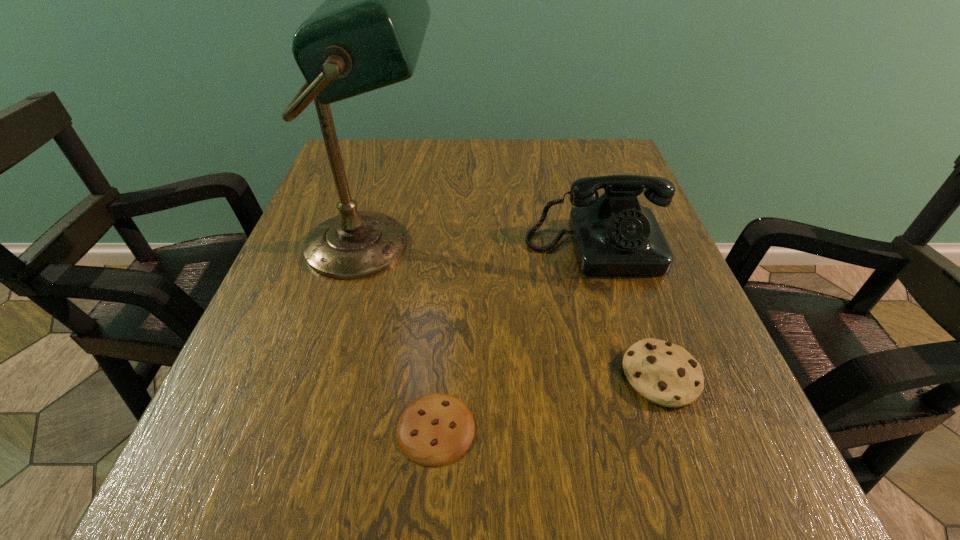
You are a GUI agent. You are given a task and a screenshot of the screen. Output one action in this format:
    pyautogui.click(x=<x>, y=<y>)
    Task: Click on the free space that is in between the shortest object and the tallest object
    
    Given the screenshot: What is the action you would take?
    pyautogui.click(x=404, y=336)

I want to click on object that is the third nearest to the table lamp, so click(664, 373).

Identify which object is the third closest to the shortest object. Please provide its 2D coordinates. Your answer should be formatted as a tuple, i.e. [(x, y)], where the tuple contains the x and y coordinates of a point satisfying the conditions above.

[(613, 234)]

This screenshot has height=540, width=960. Find the location of `vacant space that satisfies the following two spatial constraints: 1. above the green lampshade of the tallest object; 2. on the back side of the taller cookie`. vacant space that satisfies the following two spatial constraints: 1. above the green lampshade of the tallest object; 2. on the back side of the taller cookie is located at coordinates (337, 375).

Where is `vacant space that satisfies the following two spatial constraints: 1. above the green lampshade of the table lamp; 2. on the right side of the right cookie`? The height and width of the screenshot is (540, 960). vacant space that satisfies the following two spatial constraints: 1. above the green lampshade of the table lamp; 2. on the right side of the right cookie is located at coordinates (337, 375).

The image size is (960, 540). What are the coordinates of `vacant space that satisfies the following two spatial constraints: 1. above the green lampshade of the shortest object; 2. on the right side of the tallest object` in the screenshot? It's located at (323, 428).

This screenshot has height=540, width=960. I want to click on free space that satisfies the following two spatial constraints: 1. on the back side of the shortest object; 2. above the green lampshade of the table lamp, so click(x=450, y=245).

Locate an element on the screen. The height and width of the screenshot is (540, 960). vacant space that satisfies the following two spatial constraints: 1. on the back side of the right cookie; 2. above the green lampshade of the table lamp is located at coordinates (615, 245).

You are a GUI agent. You are given a task and a screenshot of the screen. Output one action in this format:
    pyautogui.click(x=<x>, y=<y>)
    Task: Click on the free space that satisfies the following two spatial constraints: 1. above the green lampshade of the table lamp; 2. on the back side of the third tallest object
    This screenshot has height=540, width=960.
    Given the screenshot: What is the action you would take?
    pyautogui.click(x=337, y=375)

Image resolution: width=960 pixels, height=540 pixels. I want to click on vacant space that satisfies the following two spatial constraints: 1. on the back side of the shortest object; 2. on the left side of the second shortest object, so click(440, 375).